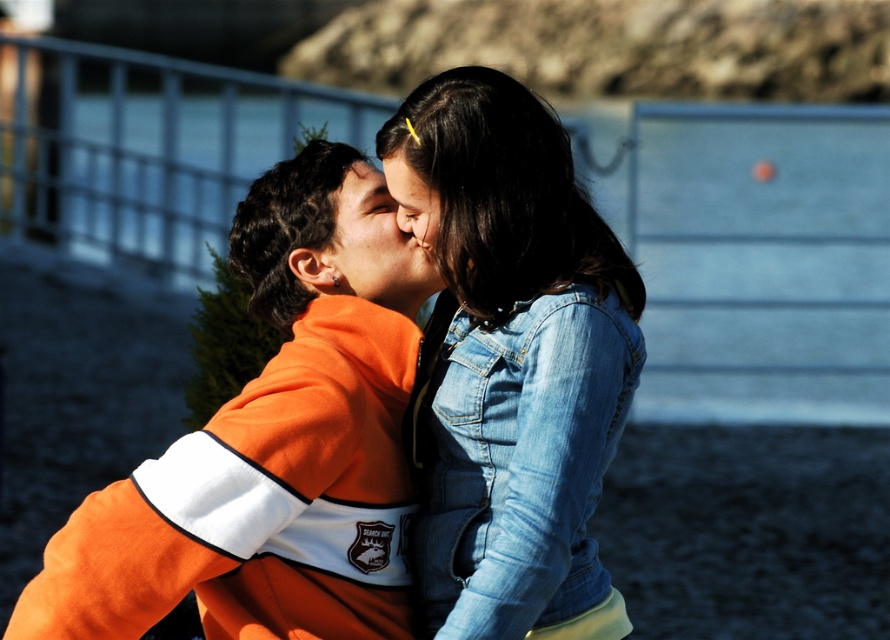
You are a photographer trying to capture a candid shot of the denim jacket at upper center and the matte orange sweatshirt at center. Since you want to ensure both subjects are in focus, you need to know which one is closer to the camera. Based on the scene description, can you determine which is closer?

The denim jacket at upper center is taller than the matte orange sweatshirt at center in the image, which suggests that the denim jacket at upper center is closer to the camera since objects closer to the camera appear larger.

You are a photographer trying to capture a candid shot of the two people. You need to ensure that both the faded denim jacket at lower right and the matte orange sweatshirt at center are fully visible in the frame. Based on their positions, which one might require you to adjust your camera angle to avoid being cut off?

The faded denim jacket at lower right is taller than the matte orange sweatshirt at center, so it might require adjusting the camera angle to avoid being cut off since it is taller.

You are designing a safety poster and need to ensure the two jackets in the image are spaced appropriately. Given that the recommended minimum distance between safety equipment labels is 5 inches, does the spacing between the denim jacket at upper center and the matte orange sweatshirt at center meet the requirement?

The distance between the denim jacket at upper center and the matte orange sweatshirt at center is 5.48 inches, which exceeds the recommended minimum of 5 inches. Therefore, the spacing meets the requirement.